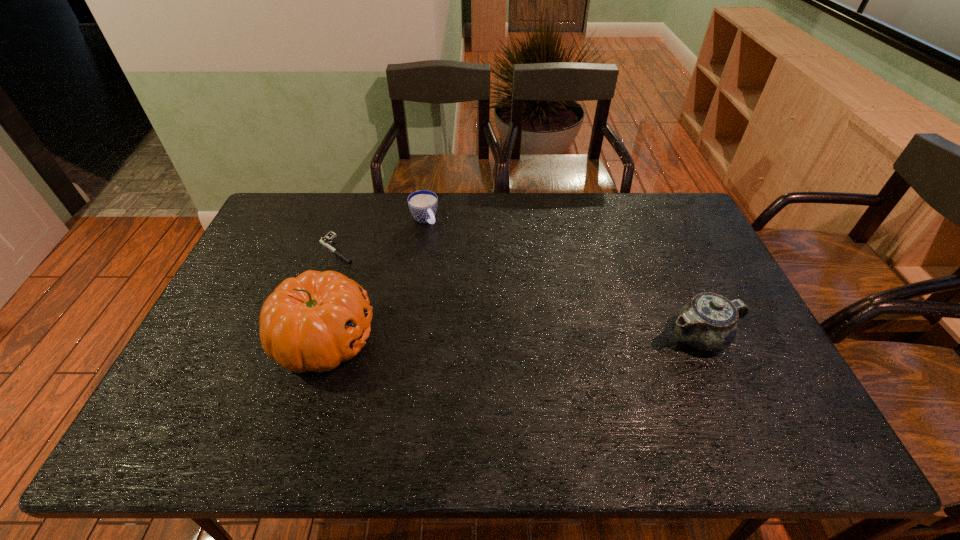
This screenshot has height=540, width=960. In order to click on free spot between the pumpkin and the cup in this screenshot , I will do `click(374, 279)`.

Identify the location of free area in between the tallest object and the cup. (374, 279).

This screenshot has height=540, width=960. I want to click on the closest object relative to the pumpkin, so click(327, 241).

Locate an element on the screen. object that can be found as the third closest to the pumpkin is located at coordinates (708, 322).

The image size is (960, 540). I want to click on blank space that satisfies the following two spatial constraints: 1. on the front side of the shortest object; 2. on the carved face of the pumpkin, so click(305, 339).

Where is `free space that satisfies the following two spatial constraints: 1. on the front side of the third nearest object; 2. on the carved face of the pumpkin`? free space that satisfies the following two spatial constraints: 1. on the front side of the third nearest object; 2. on the carved face of the pumpkin is located at coordinates (305, 339).

At what (x,y) coordinates should I click in order to perform the action: click on free space that satisfies the following two spatial constraints: 1. on the back side of the third nearest object; 2. on the left side of the third object from left to right. Please return your answer as a coordinate pair (x, y). This screenshot has height=540, width=960. Looking at the image, I should click on (347, 220).